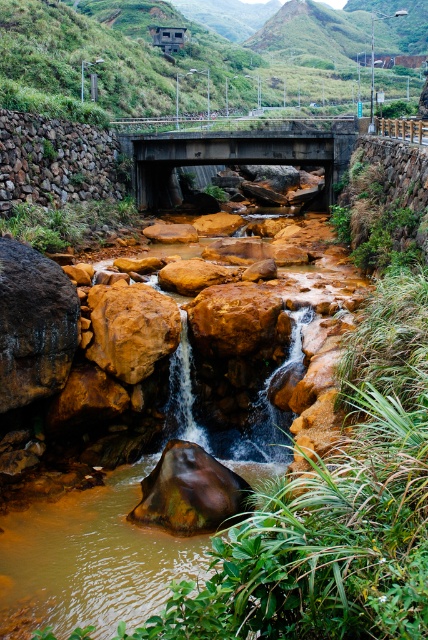
You are a hiker trying to cross the stream safely. You notice the concrete bridge at upper center and the rustic stone wall at left. Which structure is positioned higher in elevation?

The concrete bridge at upper center is located above the rustic stone wall at left, meaning it is higher in elevation.

You are standing on the concrete bridge at upper center and want to walk to the rustic stone wall at left. Which direction should you face to move towards it?

You should face towards the left because the rustic stone wall at left is positioned to the left side of the concrete bridge at upper center.